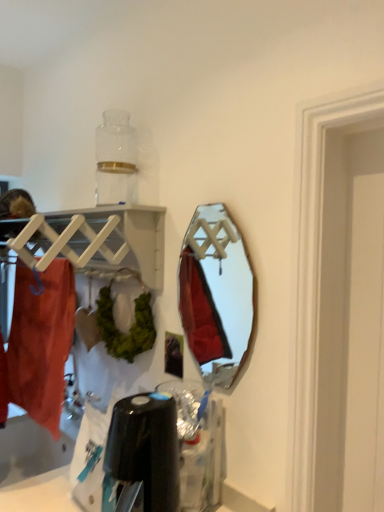
Question: From the image's perspective, does matte orange towel at left appear higher than white matte wooden shelf at upper left?

Choices:
 (A) yes
 (B) no

Answer: (B)

Question: From a real-world perspective, is matte orange towel at left physically above white matte wooden shelf at upper left?

Choices:
 (A) yes
 (B) no

Answer: (B)

Question: From a real-world perspective, is matte orange towel at left positioned under white matte wooden shelf at upper left based on gravity?

Choices:
 (A) no
 (B) yes

Answer: (B)

Question: Does matte orange towel at left turn towards white matte wooden shelf at upper left?

Choices:
 (A) yes
 (B) no

Answer: (B)

Question: Considering the relative sizes of matte orange towel at left and white matte wooden shelf at upper left in the image provided, is matte orange towel at left wider than white matte wooden shelf at upper left?

Choices:
 (A) no
 (B) yes

Answer: (A)

Question: Is matte orange towel at left not near white matte wooden shelf at upper left?

Choices:
 (A) no
 (B) yes

Answer: (A)

Question: Is matte orange towel at left thinner than metallic silver mirror at center?

Choices:
 (A) no
 (B) yes

Answer: (A)

Question: From a real-world perspective, is matte orange towel at left below metallic silver mirror at center?

Choices:
 (A) yes
 (B) no

Answer: (A)

Question: Is matte orange towel at left turned away from metallic silver mirror at center?

Choices:
 (A) no
 (B) yes

Answer: (A)

Question: Does matte orange towel at left turn towards metallic silver mirror at center?

Choices:
 (A) no
 (B) yes

Answer: (A)

Question: Does matte orange towel at left appear on the right side of metallic silver mirror at center?

Choices:
 (A) no
 (B) yes

Answer: (A)

Question: Is the position of matte orange towel at left more distant than that of metallic silver mirror at center?

Choices:
 (A) no
 (B) yes

Answer: (B)

Question: Is matte orange towel at left a part of metallic silver mirror at center?

Choices:
 (A) yes
 (B) no

Answer: (B)